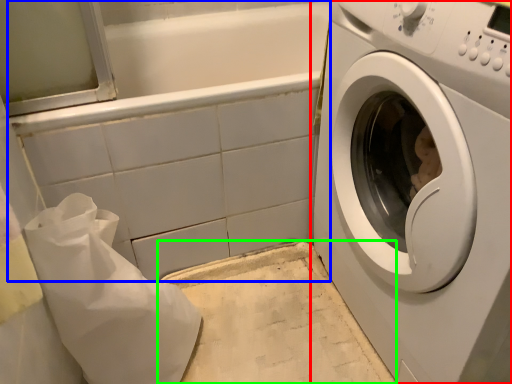
Question: Which object is positioned closest to washing machine (highlighted by a red box)? Select from bath (highlighted by a blue box) and counter top (highlighted by a green box).

Choices:
 (A) bath
 (B) counter top

Answer: (B)